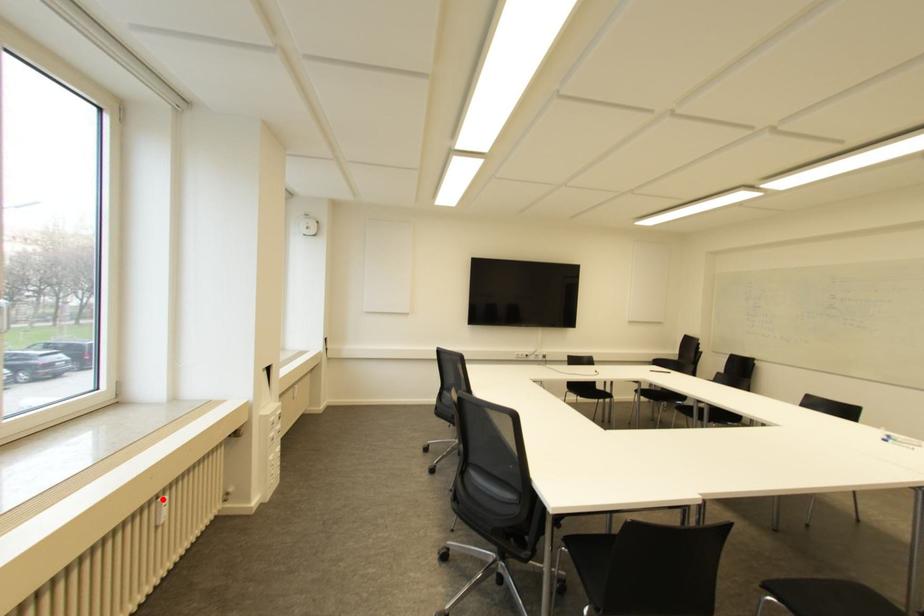
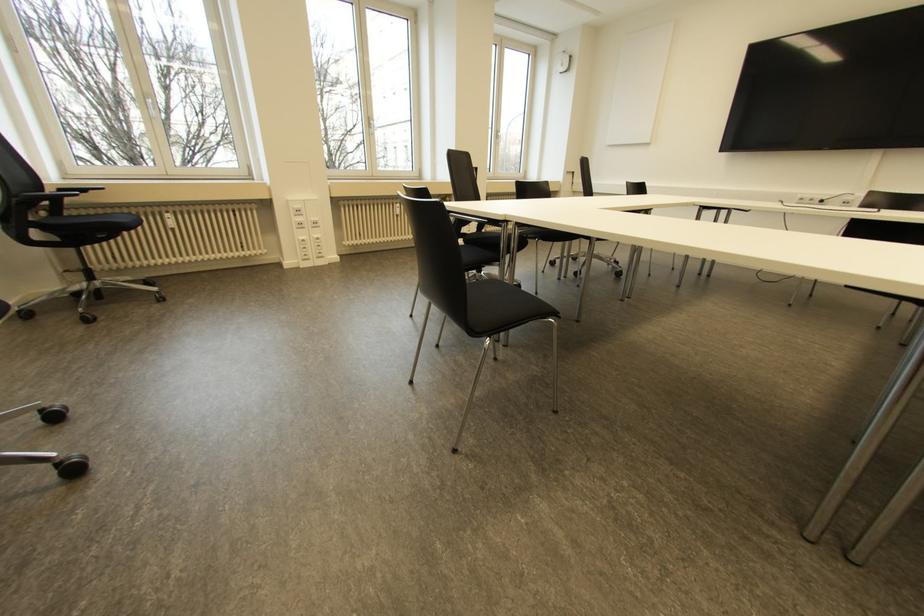
In the second image, find the point that corresponds to the highlighted location in the first image.

(397, 204)